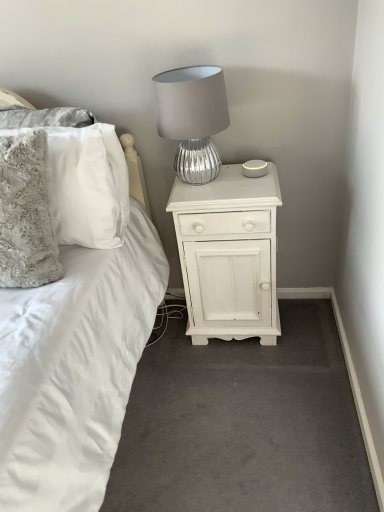
Identify the location of free space to the left of white painted wood nightstand at center. (167, 346).